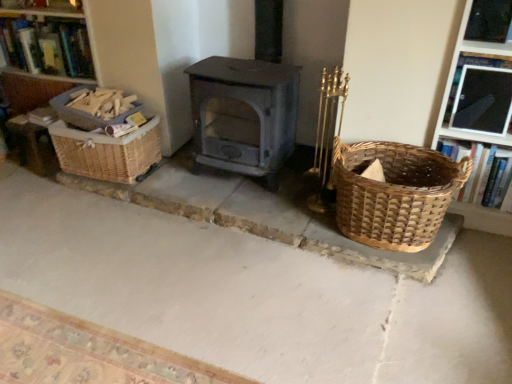
Question: From the image's perspective, is woven brown basket at right, acting as the 3th basket starting from the left, located above or below woven brown basket at left, acting as the second basket starting from the right?

Choices:
 (A) below
 (B) above

Answer: (A)

Question: Is woven brown basket at right, the 1th basket viewed from the right, taller or shorter than woven brown basket at left, acting as the second basket starting from the right?

Choices:
 (A) tall
 (B) short

Answer: (A)

Question: Considering the real-world distances, which object is farthest from the hardcover book at upper left, arranged as the second book when ordered from the bottom?

Choices:
 (A) woven wood basket at left
 (B) woven brown basket at left, which appears as the second basket when viewed from the left
 (C) white woven mat at lower center
 (D) woven basket at right, arranged as the first book when viewed from the right
 (E) woven brown basket at right, the 1th basket viewed from the right

Answer: (D)

Question: Which object is the farthest from the woven brown basket at right, the 1th basket viewed from the right?

Choices:
 (A) woven brown basket at left, acting as the second basket starting from the right
 (B) woven wood basket at left, placed as the 1th basket when sorted from left to right
 (C) hardcover book at upper left, which is counted as the first book, starting from the top
 (D) woven basket at right, placed as the second book when sorted from left to right
 (E) woven wood basket at left

Answer: (E)